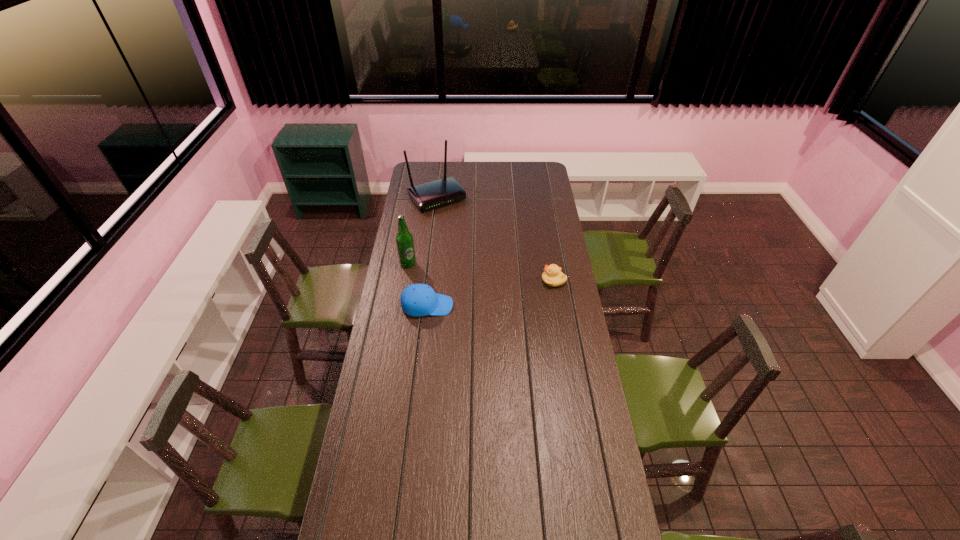
Identify the location of vacant space at the near edge of the desktop. (489, 523).

Locate an element on the screen. Image resolution: width=960 pixels, height=540 pixels. free location at the left edge is located at coordinates (405, 269).

The width and height of the screenshot is (960, 540). Identify the location of vacant space at the right edge. (537, 229).

Identify the location of blank space at the far right corner of the desktop. (535, 177).

At what (x,y) coordinates should I click in order to perform the action: click on vacant space at the near right corner of the desktop. Please return your answer as a coordinate pair (x, y). The width and height of the screenshot is (960, 540). Looking at the image, I should click on (616, 526).

Locate an element on the screen. free space between the beer bottle and the third farthest object is located at coordinates (481, 272).

Where is `empty location between the nearest object and the rightmost object`? This screenshot has height=540, width=960. empty location between the nearest object and the rightmost object is located at coordinates (491, 293).

I want to click on unoccupied position between the nearest object and the router, so click(432, 252).

You are a GUI agent. You are given a task and a screenshot of the screen. Output one action in this format:
    pyautogui.click(x=<x>, y=<y>)
    Task: Click on the free space between the cap and the second nearest object
    
    Given the screenshot: What is the action you would take?
    pyautogui.click(x=491, y=293)

I want to click on free space between the beer bottle and the rightmost object, so click(481, 272).